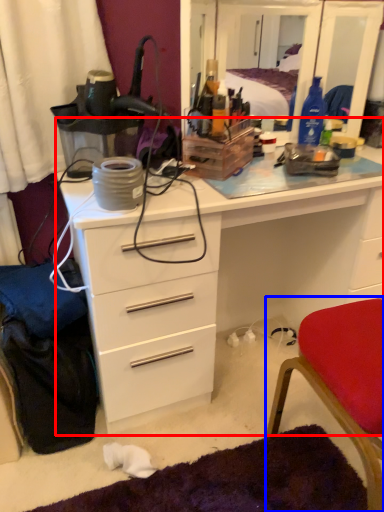
Question: Which object appears closest to the camera in this image, chest of drawers (highlighted by a red box) or chair (highlighted by a blue box)?

Choices:
 (A) chest of drawers
 (B) chair

Answer: (B)